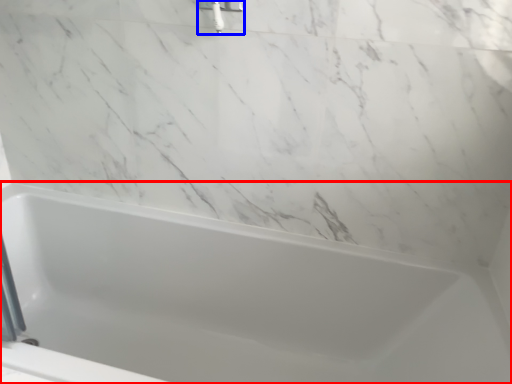
Question: Which of the following is the closest to the observer, bathtub (highlighted by a red box) or shower (highlighted by a blue box)?

Choices:
 (A) bathtub
 (B) shower

Answer: (A)